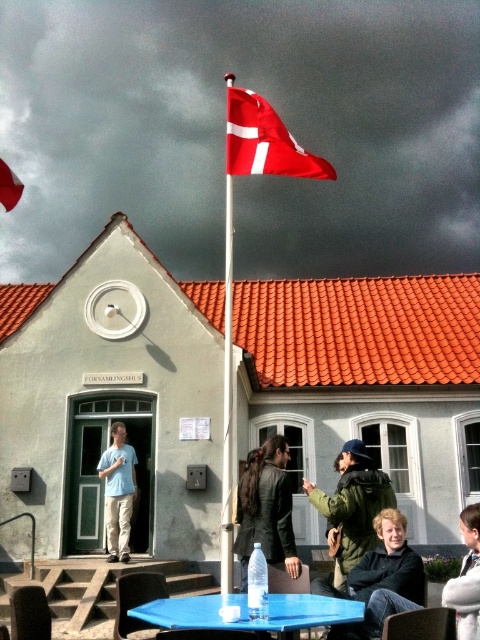
Question: Can you confirm if blue plastic table at center is positioned to the left of light blue t-shirt at center?

Choices:
 (A) yes
 (B) no

Answer: (B)

Question: Estimate the real-world distances between objects in this image. Which object is closer to the leather jacket at center?

Choices:
 (A) dark green jacket at lower right
 (B) red fabric flag at center

Answer: (A)

Question: Can you confirm if matte black jacket at lower right is positioned below light blue t-shirt at center?

Choices:
 (A) yes
 (B) no

Answer: (B)

Question: Can you confirm if green matte jacket at center is wider than leather jacket at center?

Choices:
 (A) yes
 (B) no

Answer: (B)

Question: Which object is farther from the camera taking this photo?

Choices:
 (A) blue plastic table at center
 (B) leather jacket at center
 (C) red fabric flag at upper center

Answer: (C)

Question: Which of the following is the closest to the observer?

Choices:
 (A) (472, 529)
 (B) (357, 448)
 (C) (365, 579)

Answer: (A)